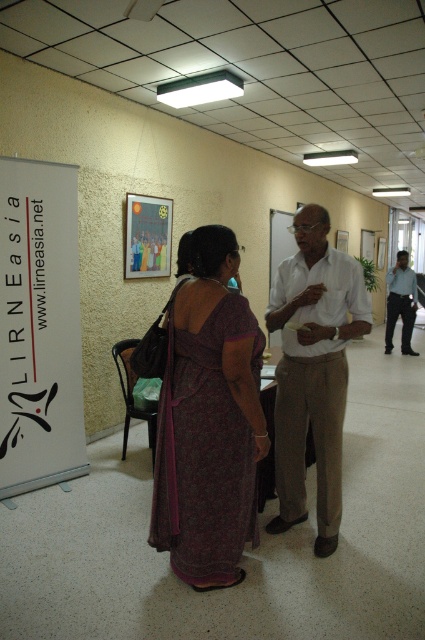
Can you confirm if white paper at left is positioned to the right of blue shirt at center?

In fact, white paper at left is to the left of blue shirt at center.

Does white paper at left come behind blue shirt at center?

No, white paper at left is in front of blue shirt at center.

At what (x,y) coordinates should I click in order to perform the action: click on white paper at left. Please return your answer as a coordinate pair (x, y). The image size is (425, 640). Looking at the image, I should click on (39, 326).

Does purple printed saree at center appear under blue shirt at center?

Indeed, purple printed saree at center is positioned under blue shirt at center.

Consider the image. Is purple printed saree at center to the right of blue shirt at center from the viewer's perspective?

Incorrect, purple printed saree at center is not on the right side of blue shirt at center.

Identify the location of purple printed saree at center. The width and height of the screenshot is (425, 640). (209, 420).

Between point (42, 401) and point (167, 237), which one is positioned behind?

The point (167, 237) is more distant.

What do you see at coordinates (39, 326) in the screenshot? The image size is (425, 640). I see `white paper at left` at bounding box center [39, 326].

Identify the location of white paper at left. (39, 326).